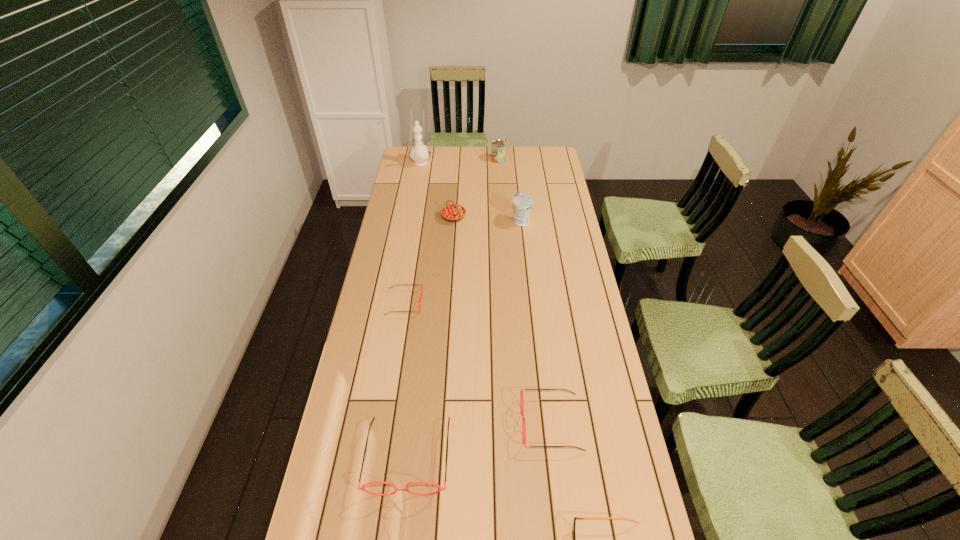
Image resolution: width=960 pixels, height=540 pixels. In order to click on vacant area that lies between the blue yogurt and the strawberry in this screenshot , I will do `click(488, 219)`.

What are the coordinates of `free space that is in between the second tallest object and the third shortest spectacles` in the screenshot? It's located at (525, 292).

At what (x,y) coordinates should I click in order to perform the action: click on the third closest object to the blue yogurt. Please return your answer as a coordinate pair (x, y). This screenshot has width=960, height=540. Looking at the image, I should click on (420, 297).

This screenshot has width=960, height=540. Find the location of `object that is the fifth closest to the blue yogurt`. object that is the fifth closest to the blue yogurt is located at coordinates (521, 398).

What are the coordinates of `the second closest spectacles to the tallest spectacles` in the screenshot? It's located at click(x=574, y=536).

Find the location of a particular element. spectacles object that ranks as the second closest to the biggest red spectacles is located at coordinates coord(574,536).

Where is `red spectacles that can be found as the third closest to the nearest object`? This screenshot has height=540, width=960. red spectacles that can be found as the third closest to the nearest object is located at coordinates (420, 297).

Locate which red spectacles ranks second in proximity to the farthest spectacles. Please provide its 2D coordinates. Your answer should be formatted as a tuple, i.e. [(x, y)], where the tuple contains the x and y coordinates of a point satisfying the conditions above.

[(521, 398)]

You are a GUI agent. You are given a task and a screenshot of the screen. Output one action in this format:
    pyautogui.click(x=<x>, y=<y>)
    Task: Click on the free spot that satisfies the following two spatial constraints: 1. on the back side of the can; 2. on the right side of the brown strawberry
    The image size is (960, 540).
    Given the screenshot: What is the action you would take?
    pyautogui.click(x=458, y=160)

You are a GUI agent. You are given a task and a screenshot of the screen. Output one action in this format:
    pyautogui.click(x=<x>, y=<y>)
    Task: Click on the free spot that satisfies the following two spatial constraints: 1. at the spout of the tallest object; 2. on the right side of the blue yogurt
    This screenshot has height=540, width=960.
    Given the screenshot: What is the action you would take?
    pyautogui.click(x=410, y=221)